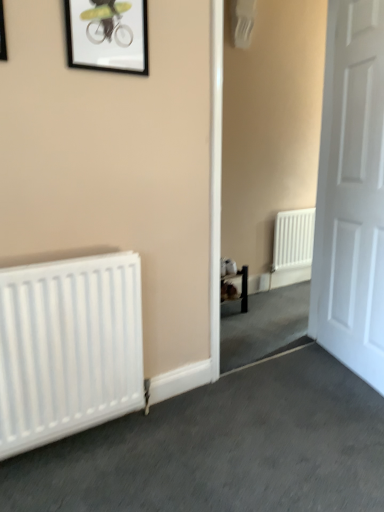
In the scene shown: What is the approximate height of matte black picture frame at upper left, marked as the second picture frame in a right-to-left arrangement?

The height of matte black picture frame at upper left, marked as the second picture frame in a right-to-left arrangement, is 17.47 inches.

In order to face white matte radiator at left, should I rotate leftwards or rightwards?

You should look left and rotate roughly 15.186 degrees.

This screenshot has height=512, width=384. What are the coordinates of `matte black picture frame at upper left, which ranks as the 1th picture frame in front-to-back order` in the screenshot? It's located at (2, 35).

From the image's perspective, is white matte door at right located beneath black matte picture frame at upper center, placed as the 2th picture frame when sorted from front to back?

Indeed, from the image's perspective, white matte door at right is shown beneath black matte picture frame at upper center, placed as the 2th picture frame when sorted from front to back.

How distant is white matte door at right from black matte picture frame at upper center, which is counted as the first picture frame, starting from the right?

white matte door at right is 4.19 feet away from black matte picture frame at upper center, which is counted as the first picture frame, starting from the right.

Is white matte door at right in contact with black matte picture frame at upper center, the first picture frame when ordered from back to front?

white matte door at right and black matte picture frame at upper center, the first picture frame when ordered from back to front, are clearly separated.

Is white matte door at right completely or partially outside of black matte picture frame at upper center, placed as the 2th picture frame when sorted from front to back?

That's correct, white matte door at right is outside of black matte picture frame at upper center, placed as the 2th picture frame when sorted from front to back.

Could you measure the distance between black matte picture frame at upper center, placed as the 2th picture frame when sorted from front to back, and matte black picture frame at upper left, the 2th picture frame when ordered from back to front?

black matte picture frame at upper center, placed as the 2th picture frame when sorted from front to back, is 14.36 inches away from matte black picture frame at upper left, the 2th picture frame when ordered from back to front.

Is point (123, 66) closer or farther from the camera than point (0, 27)?

Clearly, point (123, 66) is more distant from the camera than point (0, 27).

From a real-world perspective, relative to matte black picture frame at upper left, the 2th picture frame when ordered from back to front, is black matte picture frame at upper center, the first picture frame when ordered from back to front, vertically above or below?

black matte picture frame at upper center, the first picture frame when ordered from back to front, is situated higher than matte black picture frame at upper left, the 2th picture frame when ordered from back to front, in the real world.

From the image's perspective, would you say black matte picture frame at upper center, the first picture frame when ordered from back to front, is shown under matte black picture frame at upper left, the 2th picture frame when ordered from back to front?

No, from the image's perspective, black matte picture frame at upper center, the first picture frame when ordered from back to front, is not below matte black picture frame at upper left, the 2th picture frame when ordered from back to front.

Considering the relative sizes of white matte radiator at left and white matte door at right in the image provided, is white matte radiator at left shorter than white matte door at right?

Yes.

This screenshot has width=384, height=512. I want to click on door above the white matte radiator at left (from a real-world perspective), so click(351, 193).

Does white matte radiator at left have a smaller size compared to black matte picture frame at upper center, the first picture frame when ordered from back to front?

Incorrect, white matte radiator at left is not smaller in size than black matte picture frame at upper center, the first picture frame when ordered from back to front.

Based on the photo, which object is positioned more to the right, white matte radiator at left or black matte picture frame at upper center, which is counted as the first picture frame, starting from the right?

From the viewer's perspective, black matte picture frame at upper center, which is counted as the first picture frame, starting from the right, appears more on the right side.

Does point (34, 365) lie behind point (104, 22)?

No, (34, 365) is closer to viewer.

Is white matte radiator at left aimed at black matte picture frame at upper center, which ranks as the 2th picture frame in left-to-right order?

No.

From a real-world perspective, is black matte picture frame at upper center, which ranks as the 2th picture frame in left-to-right order, physically located above or below white matte door at right?

In terms of real-world spatial position, black matte picture frame at upper center, which ranks as the 2th picture frame in left-to-right order, is above white matte door at right.

Relative to white matte door at right, is black matte picture frame at upper center, which ranks as the 2th picture frame in left-to-right order, in front or behind?

Visually, black matte picture frame at upper center, which ranks as the 2th picture frame in left-to-right order, is located in front of white matte door at right.

In the image, is black matte picture frame at upper center, which is counted as the first picture frame, starting from the right, on the left side or the right side of white matte door at right?

In the image, black matte picture frame at upper center, which is counted as the first picture frame, starting from the right, appears on the left side of white matte door at right.

Does black matte picture frame at upper center, which is counted as the first picture frame, starting from the right, turn towards white matte door at right?

No, black matte picture frame at upper center, which is counted as the first picture frame, starting from the right, is not aimed at white matte door at right.

Based on their positions, is matte black picture frame at upper left, marked as the second picture frame in a right-to-left arrangement, located to the left or right of black matte picture frame at upper center, which ranks as the 2th picture frame in left-to-right order?

matte black picture frame at upper left, marked as the second picture frame in a right-to-left arrangement, is positioned on black matte picture frame at upper center, which ranks as the 2th picture frame in left-to-right order,'s left side.

Which of these two, matte black picture frame at upper left, marked as the second picture frame in a right-to-left arrangement, or black matte picture frame at upper center, placed as the 2th picture frame when sorted from front to back, stands shorter?

matte black picture frame at upper left, marked as the second picture frame in a right-to-left arrangement, is shorter.

Which is less distant, [5,42] or [111,22]?

Point [5,42].

In terms of width, does matte black picture frame at upper left, the 1th picture frame in the left-to-right sequence, look wider or thinner when compared to white matte radiator at left?

matte black picture frame at upper left, the 1th picture frame in the left-to-right sequence, is thinner than white matte radiator at left.

From the image's perspective, who appears lower, matte black picture frame at upper left, which ranks as the 1th picture frame in front-to-back order, or white matte radiator at left?

white matte radiator at left, from the image's perspective.

Would you consider matte black picture frame at upper left, which ranks as the 1th picture frame in front-to-back order, to be distant from white matte radiator at left?

Yes, matte black picture frame at upper left, which ranks as the 1th picture frame in front-to-back order, is far from white matte radiator at left.

Which is closer to the camera, (3, 41) or (129, 342)?

Clearly, point (3, 41) is closer to the camera than point (129, 342).

From a real-world perspective, starting from the white matte door at right, which picture frame is the 2nd one vertically above it? Please provide its 2D coordinates.

[(107, 35)]

At what (x,y) coordinates should I click in order to perform the action: click on picture frame lying below the black matte picture frame at upper center, which ranks as the 2th picture frame in left-to-right order (from the image's perspective). Please return your answer as a coordinate pair (x, y). The width and height of the screenshot is (384, 512). Looking at the image, I should click on [x=2, y=35].

Which object lies nearer to the anchor point white matte radiator at left, matte black picture frame at upper left, the 2th picture frame when ordered from back to front, or black matte picture frame at upper center, the first picture frame when ordered from back to front?

black matte picture frame at upper center, the first picture frame when ordered from back to front, is closer to white matte radiator at left.

Estimate the real-world distances between objects in this image. Which object is further from matte black picture frame at upper left, the 2th picture frame when ordered from back to front, white matte door at right or black matte picture frame at upper center, which is counted as the first picture frame, starting from the right?

Based on the image, white matte door at right appears to be further to matte black picture frame at upper left, the 2th picture frame when ordered from back to front.

When comparing their distances from black matte picture frame at upper center, placed as the 2th picture frame when sorted from front to back, does white matte radiator at left or white matte door at right seem further?

The object further to black matte picture frame at upper center, placed as the 2th picture frame when sorted from front to back, is white matte door at right.

From the image, which object appears to be nearer to white matte radiator at left, matte black picture frame at upper left, the 2th picture frame when ordered from back to front, or white matte door at right?

matte black picture frame at upper left, the 2th picture frame when ordered from back to front, is positioned closer to the anchor white matte radiator at left.

Considering their positions, is white matte door at right positioned closer to matte black picture frame at upper left, marked as the second picture frame in a right-to-left arrangement, than white matte radiator at left?

The object closer to matte black picture frame at upper left, marked as the second picture frame in a right-to-left arrangement, is white matte radiator at left.

Estimate the real-world distances between objects in this image. Which object is closer to black matte picture frame at upper center, which ranks as the 2th picture frame in left-to-right order, matte black picture frame at upper left, the 2th picture frame when ordered from back to front, or white matte radiator at left?

matte black picture frame at upper left, the 2th picture frame when ordered from back to front, is positioned closer to the anchor black matte picture frame at upper center, which ranks as the 2th picture frame in left-to-right order.

Estimate the real-world distances between objects in this image. Which object is further from matte black picture frame at upper left, the 2th picture frame when ordered from back to front, black matte picture frame at upper center, which ranks as the 2th picture frame in left-to-right order, or white matte radiator at left?

white matte radiator at left lies further to matte black picture frame at upper left, the 2th picture frame when ordered from back to front, than the other object.

Which object lies further to the anchor point white matte radiator at left, white matte door at right or black matte picture frame at upper center, the first picture frame when ordered from back to front?

The object further to white matte radiator at left is white matte door at right.

The height and width of the screenshot is (512, 384). Identify the location of picture frame situated between matte black picture frame at upper left, which ranks as the 1th picture frame in front-to-back order, and white matte door at right from left to right. (107, 35).

This screenshot has height=512, width=384. I want to click on picture frame between black matte picture frame at upper center, which is counted as the first picture frame, starting from the right, and white matte radiator at left vertically, so click(2, 35).

Locate an element on the screen. picture frame between white matte radiator at left and white matte door at right from left to right is located at coordinates (107, 35).

Identify the location of radiator situated between matte black picture frame at upper left, which ranks as the 1th picture frame in front-to-back order, and white matte door at right from left to right. (68, 347).